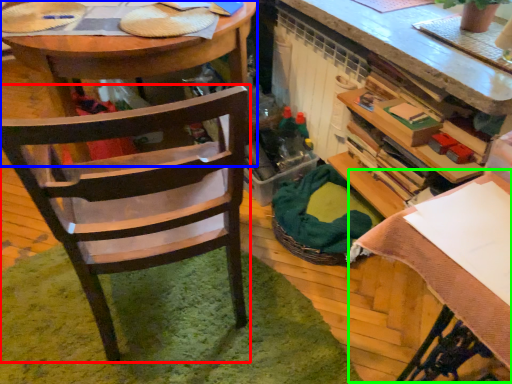
Question: Considering the real-world distances, which object is closest to chair (highlighted by a red box)? desk (highlighted by a blue box) or table (highlighted by a green box).

Choices:
 (A) desk
 (B) table

Answer: (A)